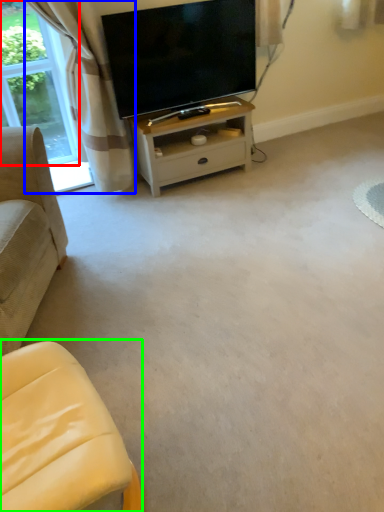
Question: Based on their relative distances, which object is nearer to bay window (highlighted by a red box)? Choose from curtain (highlighted by a blue box) and studio couch (highlighted by a green box).

Choices:
 (A) curtain
 (B) studio couch

Answer: (A)